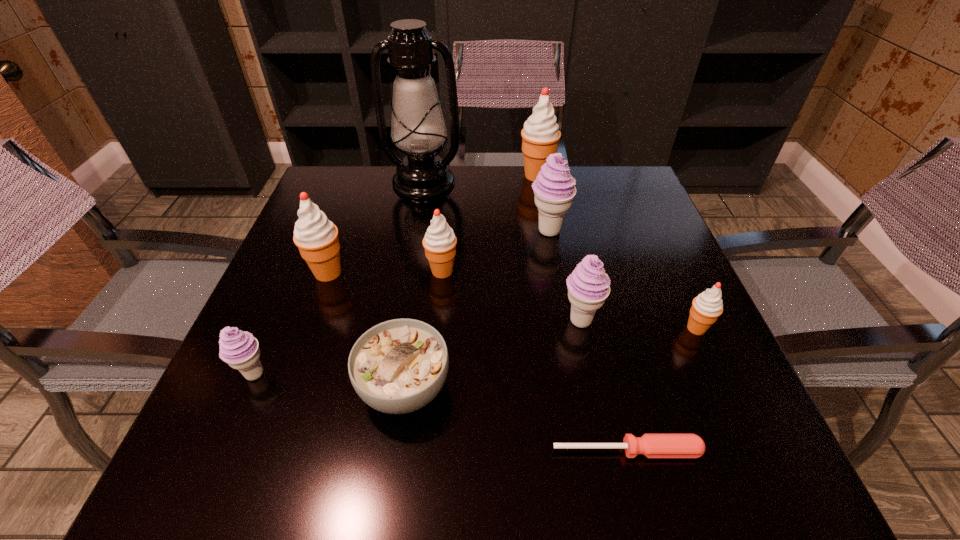
Where is `blank space located 0.350m on the front of the second farthest icecream`? blank space located 0.350m on the front of the second farthest icecream is located at coordinates (573, 367).

At what (x,y) coordinates should I click in order to perform the action: click on free space located on the back of the leftmost red icecream. Please return your answer as a coordinate pair (x, y). Looking at the image, I should click on (362, 178).

Identify the location of free spot located on the front of the third red icecream from right to left. (431, 393).

Where is `vacant area located 0.210m on the front of the second biggest purple icecream`? vacant area located 0.210m on the front of the second biggest purple icecream is located at coordinates (606, 441).

What are the coordinates of `free point located on the front of the rightmost object` in the screenshot? It's located at (722, 384).

I want to click on free space located 0.160m on the back of the smallest purple icecream, so click(287, 296).

This screenshot has height=540, width=960. I want to click on free space located on the back of the soup bowl, so click(x=420, y=273).

Locate an element on the screen. The image size is (960, 540). vacant area situated on the right of the shortest object is located at coordinates (732, 450).

Where is `oil lamp situated at the far edge`? oil lamp situated at the far edge is located at coordinates (418, 127).

The width and height of the screenshot is (960, 540). Find the location of `icecream at the far edge`. icecream at the far edge is located at coordinates (540, 135).